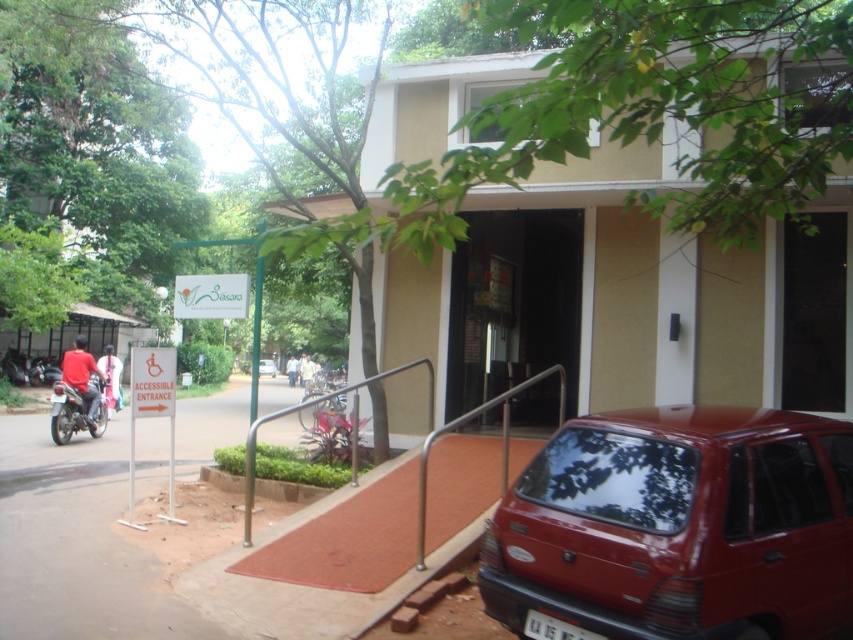
You are standing at the entrance of the building and want to park your vehicle. You have a matte red car at lower right and a red matte motorcycle at left. Which vehicle is closer to the entrance?

The red matte motorcycle at left is closer to the entrance since it is only 11.95 meters away from the matte red car at lower right, but the exact distance from the entrance isn

You are a person using a wheelchair and want to reach the entrance. You see the silver metallic handrail at center and the shiny black motorcycle at left. Which object is closer to the entrance?

The silver metallic handrail at center is closer to the entrance because it is to the right of the shiny black motorcycle at left, meaning the motorcycle is further away from the entrance compared to the handrail.